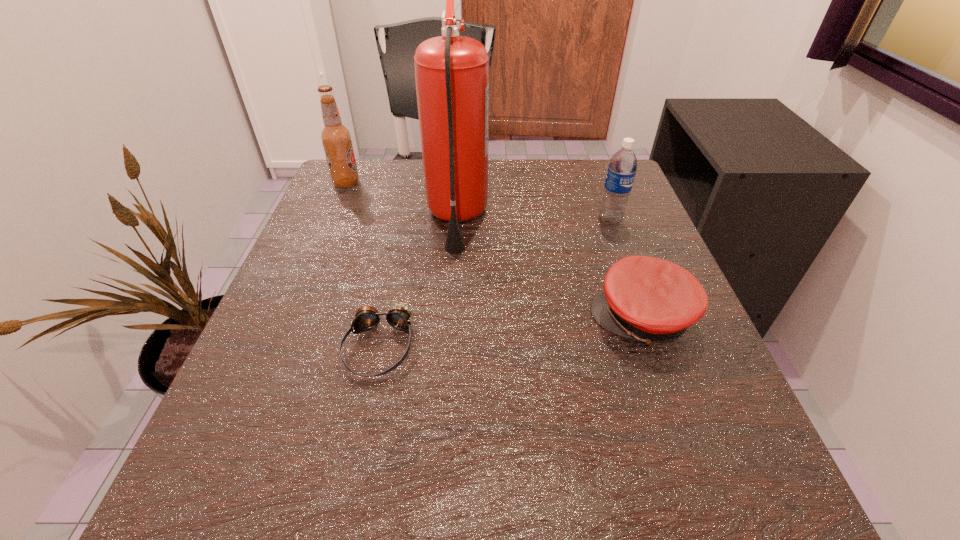
Where is `object that is at the far left corner`? This screenshot has width=960, height=540. object that is at the far left corner is located at coordinates (336, 138).

Locate an element on the screen. object that is at the far right corner is located at coordinates (622, 167).

Find the location of `vacant region at the far edge of the desktop`. vacant region at the far edge of the desktop is located at coordinates (419, 174).

Where is `free space at the near edge of the desktop`? This screenshot has width=960, height=540. free space at the near edge of the desktop is located at coordinates (361, 493).

Locate an element on the screen. The width and height of the screenshot is (960, 540). vacant space at the left edge is located at coordinates (331, 268).

In order to click on vacant space at the right edge in this screenshot , I will do `click(626, 225)`.

The height and width of the screenshot is (540, 960). Identify the location of vacant space at the far left corner of the desktop. (404, 159).

In the image, there is a desktop. What are the coordinates of `vacant space at the near left corner` in the screenshot? It's located at (246, 500).

Find the location of a particular element. Image resolution: width=960 pixels, height=540 pixels. vacant area at the far right corner is located at coordinates pyautogui.click(x=594, y=213).

At what (x,y) coordinates should I click in order to perform the action: click on vacant space at the near right corner of the desktop. Please return your answer as a coordinate pair (x, y). The image size is (960, 540). Looking at the image, I should click on 648,460.